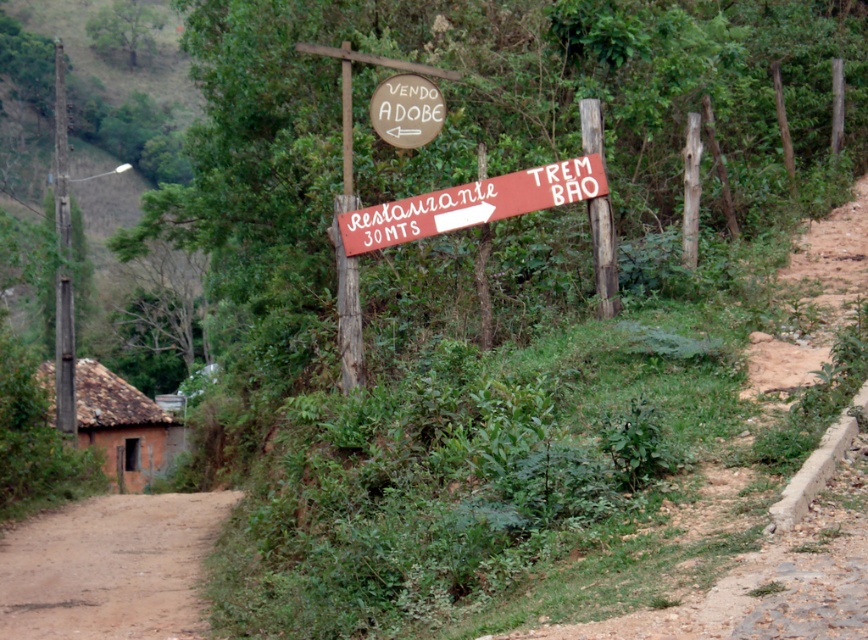
You are a hiker who wants to follow the path indicated by the wooden sign. From your current position, which direction should you walk to reach the brown dirt track at lower left while staying on the path near the brown wooden sign at upper center?

The brown dirt track at lower left is located below the brown wooden sign at upper center, so you should walk downward towards the brown dirt track at lower left while staying near the brown wooden sign at upper center.

You are a hiker trying to navigate using the brown wooden sign at upper center. You notice the brown dirt track at lower left. Which object appears taller from your viewpoint?

The brown wooden sign at upper center appears taller than the brown dirt track at lower left because the brown dirt track at lower left is not as tall as brown wooden sign at upper center.

You are a hiker carrying a 30 inch ruler. You want to measure the distance between the red wooden sign at center and the brown wooden sign at upper center. Can you fit the ruler between them to measure the distance?

The red wooden sign at center and brown wooden sign at upper center are 29.83 inches apart from each other, so the ruler can fit between them since it is slightly shorter than the ruler length.